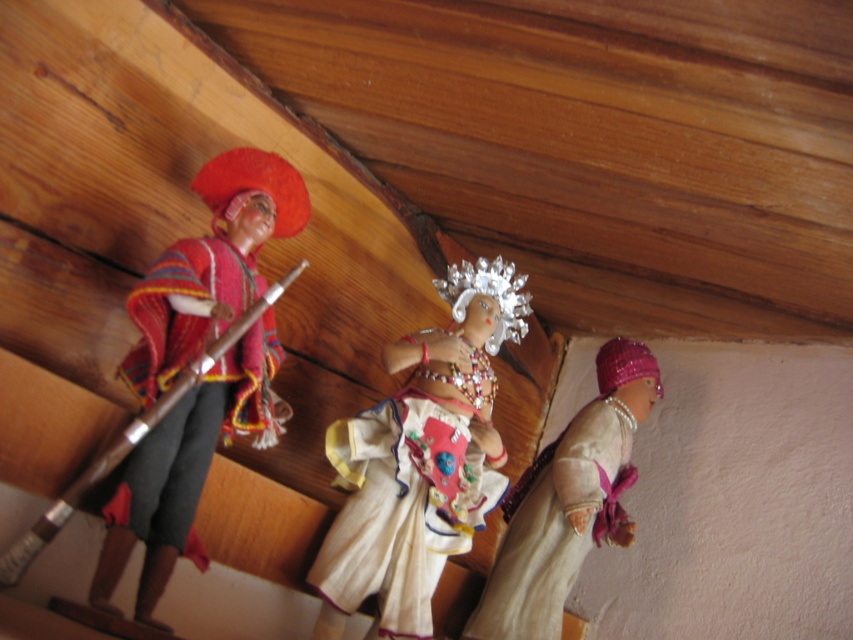
You are arranging a display of cultural artifacts in a museum. You have two items to place on a shelf that can only hold items in a vertical arrangement. The items are the beige fabric skirt at lower right and the knitted woolen poncho at left. According to the image, which item should be placed at the bottom of the shelf?

The beige fabric skirt at lower right should be placed at the bottom of the shelf because it is positioned under the knitted woolen poncho at left in the image, indicating it belongs lower in the arrangement.

You are a collector who wants to place a new figurine between the white fabric doll at center and the knitted woolen poncho at left. The new figurine is 3 inches wide. Is there enough space between them to fit the new figurine?

The distance between the white fabric doll at center and the knitted woolen poncho at left is 9.90 inches. Since the new figurine is 3 inches wide, there is sufficient space to place it between them.

You are organizing a display and need to place the white fabric doll at center and the knitted woolen poncho at left on a shelf. Which object should you place first to ensure they fit properly?

You should place the white fabric doll at center first since it is larger than the knitted woolen poncho at left, ensuring there is enough space for it on the shelf.